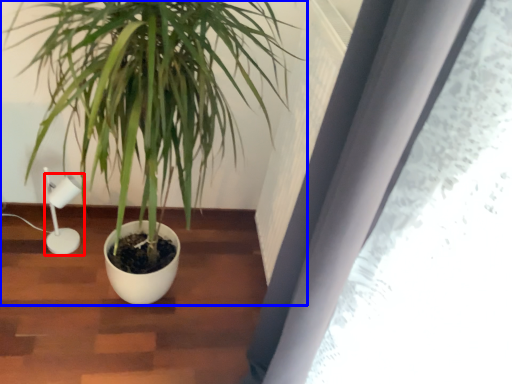
Question: Which object is closer to the camera taking this photo, lamp (highlighted by a red box) or houseplant (highlighted by a blue box)?

Choices:
 (A) lamp
 (B) houseplant

Answer: (B)